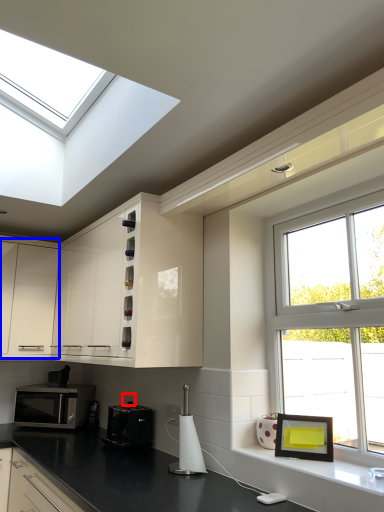
Question: Which object is closer to the camera taking this photo, electric outlet (highlighted by a red box) or cabinetry (highlighted by a blue box)?

Choices:
 (A) electric outlet
 (B) cabinetry

Answer: (A)